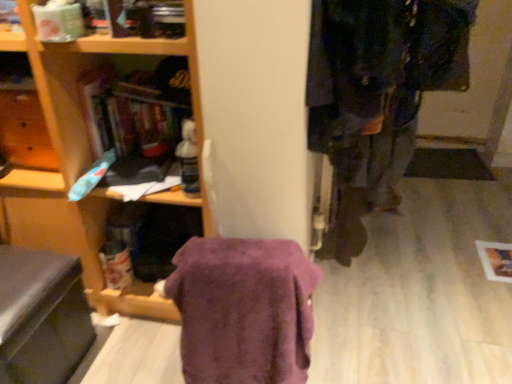
Question: Is black leather swivel chair at lower left looking in the opposite direction of dark blue fabric coat at right?

Choices:
 (A) yes
 (B) no

Answer: (B)

Question: Can you confirm if black leather swivel chair at lower left is wider than dark blue fabric coat at right?

Choices:
 (A) yes
 (B) no

Answer: (B)

Question: Can you confirm if black leather swivel chair at lower left is taller than dark blue fabric coat at right?

Choices:
 (A) yes
 (B) no

Answer: (A)

Question: From the image's perspective, does black leather swivel chair at lower left appear higher than dark blue fabric coat at right?

Choices:
 (A) no
 (B) yes

Answer: (A)

Question: Is black leather swivel chair at lower left behind dark blue fabric coat at right?

Choices:
 (A) no
 (B) yes

Answer: (B)

Question: Could you tell me if black leather swivel chair at lower left is turned towards dark blue fabric coat at right?

Choices:
 (A) no
 (B) yes

Answer: (A)

Question: Can you confirm if dark blue fabric coat at right is wider than black leather swivel chair at lower left?

Choices:
 (A) no
 (B) yes

Answer: (B)

Question: From a real-world perspective, is dark blue fabric coat at right beneath black leather swivel chair at lower left?

Choices:
 (A) no
 (B) yes

Answer: (A)

Question: Is black leather swivel chair at lower left located within dark blue fabric coat at right?

Choices:
 (A) yes
 (B) no

Answer: (B)

Question: Is dark blue fabric coat at right positioned before black leather swivel chair at lower left?

Choices:
 (A) yes
 (B) no

Answer: (A)

Question: Is dark blue fabric coat at right bigger than black leather swivel chair at lower left?

Choices:
 (A) yes
 (B) no

Answer: (A)

Question: Is dark blue fabric coat at right facing away from black leather swivel chair at lower left?

Choices:
 (A) yes
 (B) no

Answer: (B)

Question: Can you confirm if black leather swivel chair at lower left is bigger than purple fuzzy blanket at center?

Choices:
 (A) yes
 (B) no

Answer: (A)